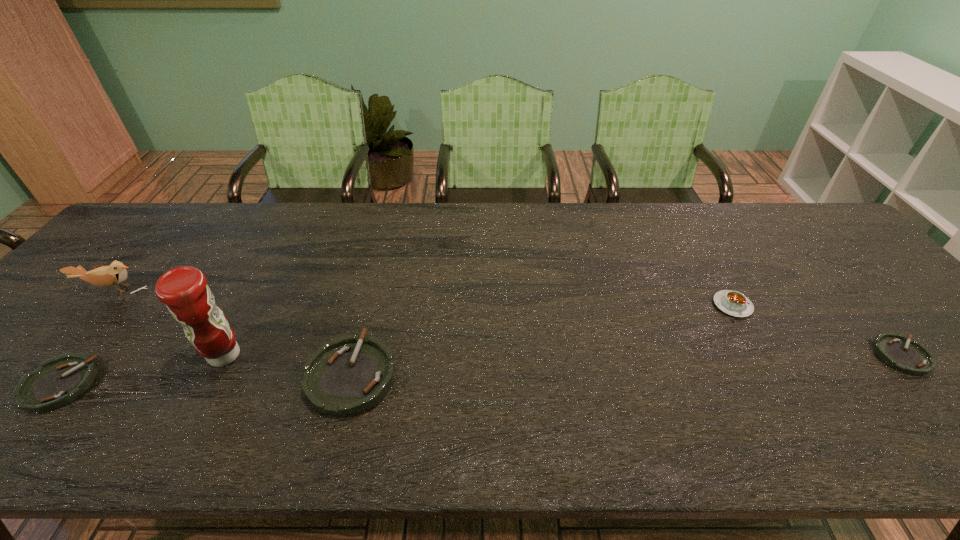
The image size is (960, 540). I want to click on vacant space in between the shortest object and the bird, so click(507, 322).

Image resolution: width=960 pixels, height=540 pixels. I want to click on free point between the condiment and the fifth shortest object, so click(168, 322).

Find the location of `empty location between the third object from left to right and the shortest ashtray`. empty location between the third object from left to right and the shortest ashtray is located at coordinates (563, 356).

This screenshot has height=540, width=960. I want to click on empty space that is in between the fifth object from left to right and the third object from left to right, so click(x=478, y=330).

The height and width of the screenshot is (540, 960). What are the coordinates of `free space that is in between the pudding and the condiment` in the screenshot? It's located at (478, 330).

Find the location of `object that stands as the closest to the leftmost ashtray`. object that stands as the closest to the leftmost ashtray is located at coordinates (115, 274).

Select which object is the closest to the second ashtray from right to left. Please provide its 2D coordinates. Your answer should be formatted as a tuple, i.e. [(x, y)], where the tuple contains the x and y coordinates of a point satisfying the conditions above.

[(184, 290)]

Identify which ashtray is located as the second nearest to the shortest ashtray. Please provide its 2D coordinates. Your answer should be formatted as a tuple, i.e. [(x, y)], where the tuple contains the x and y coordinates of a point satisfying the conditions above.

[(58, 381)]

You are a GUI agent. You are given a task and a screenshot of the screen. Output one action in this format:
    pyautogui.click(x=<x>, y=<y>)
    Task: Click on the ashtray that is the third closest to the fifth shortest object
    
    Given the screenshot: What is the action you would take?
    pyautogui.click(x=910, y=357)

Identify the location of free spot that satisfies the following two spatial constraints: 1. on the back side of the second ashtray from right to left; 2. on the right side of the second object from right to left. Image resolution: width=960 pixels, height=540 pixels. (369, 305).